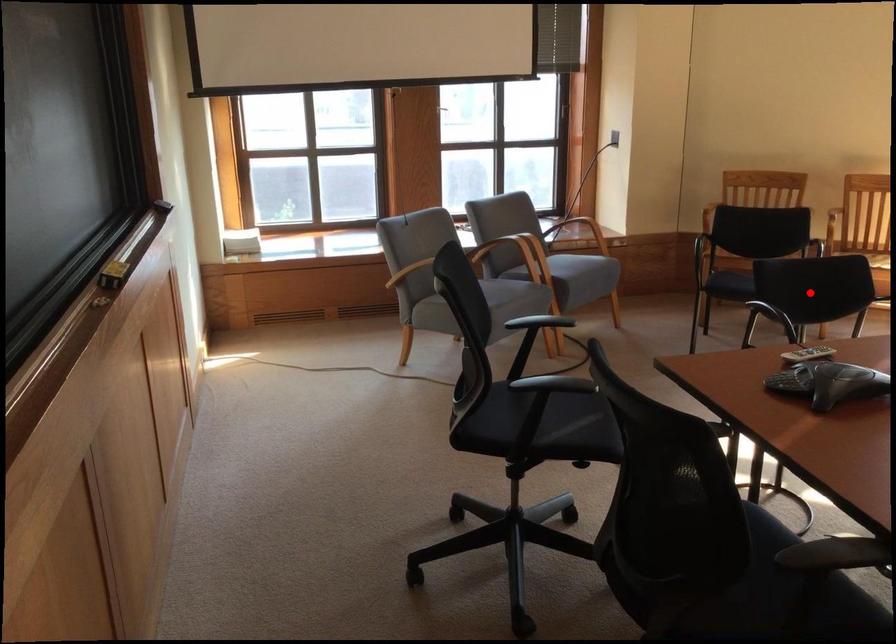
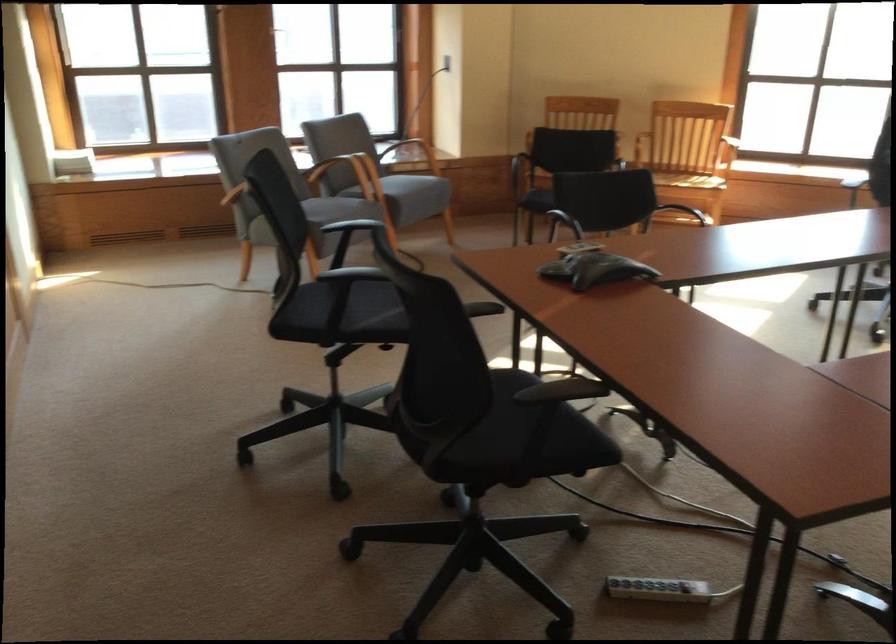
Where in the second image is the point corresponding to the highlighted location from the first image?

(602, 201)